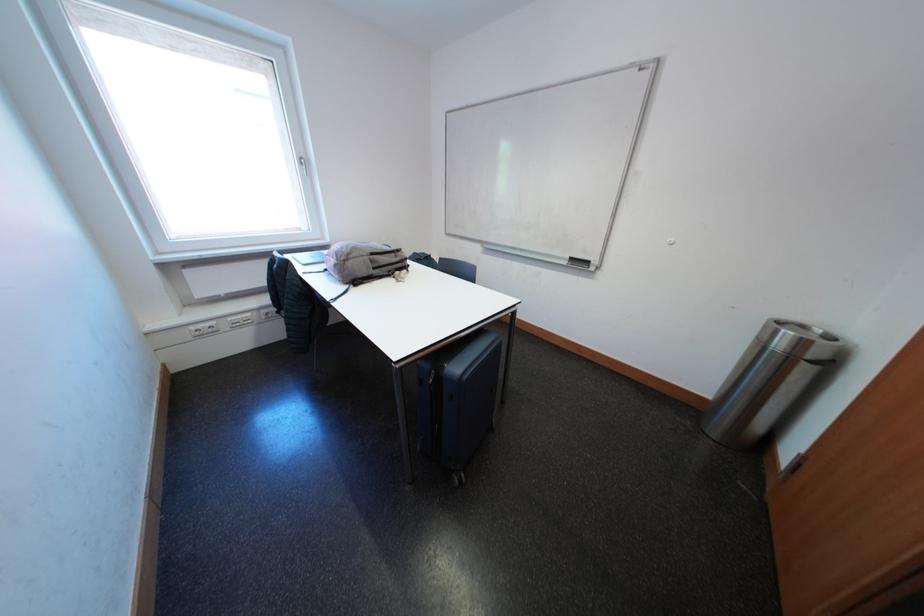
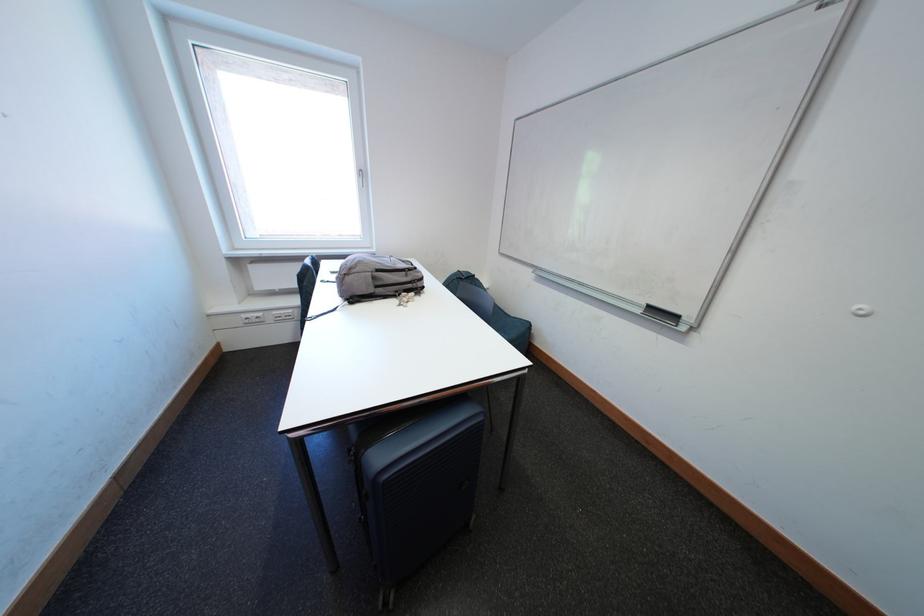
Where in the second image is the point corresponding to (398,275) from the first image?

(406, 294)